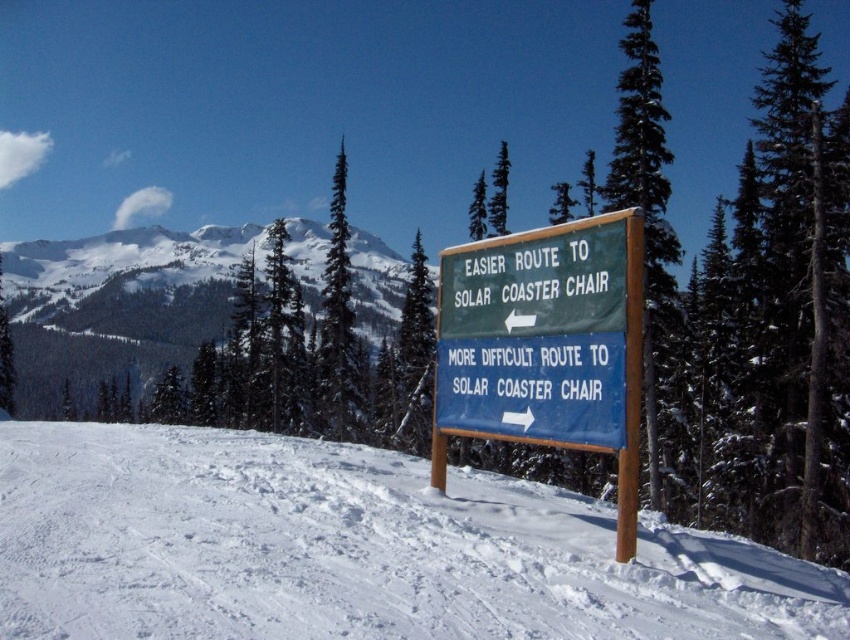
Question: Is white snow at center wider than green wooden sign at center?

Choices:
 (A) no
 (B) yes

Answer: (B)

Question: Which point is farther from the camera taking this photo?

Choices:
 (A) (382, 544)
 (B) (581, 256)

Answer: (B)

Question: Among these objects, which one is nearest to the camera?

Choices:
 (A) white snow at center
 (B) green wooden sign at center

Answer: (A)

Question: Can you confirm if white snow at center is positioned to the left of green wooden sign at center?

Choices:
 (A) no
 (B) yes

Answer: (B)

Question: Which object appears closest to the camera in this image?

Choices:
 (A) green wooden sign at center
 (B) white snow at center

Answer: (B)

Question: Observing the image, what is the correct spatial positioning of white snow at center in reference to green wooden sign at center?

Choices:
 (A) below
 (B) above

Answer: (A)